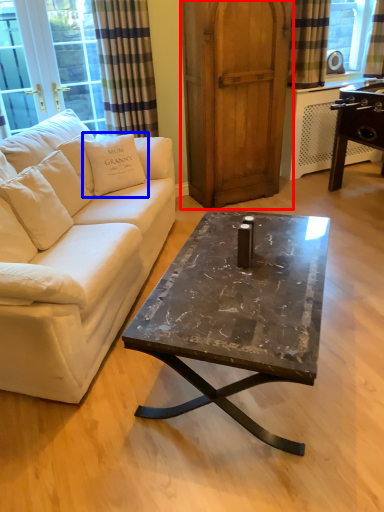
Question: Which object appears farthest to the camera in this image, armoire (highlighted by a red box) or pillow (highlighted by a blue box)?

Choices:
 (A) armoire
 (B) pillow

Answer: (A)